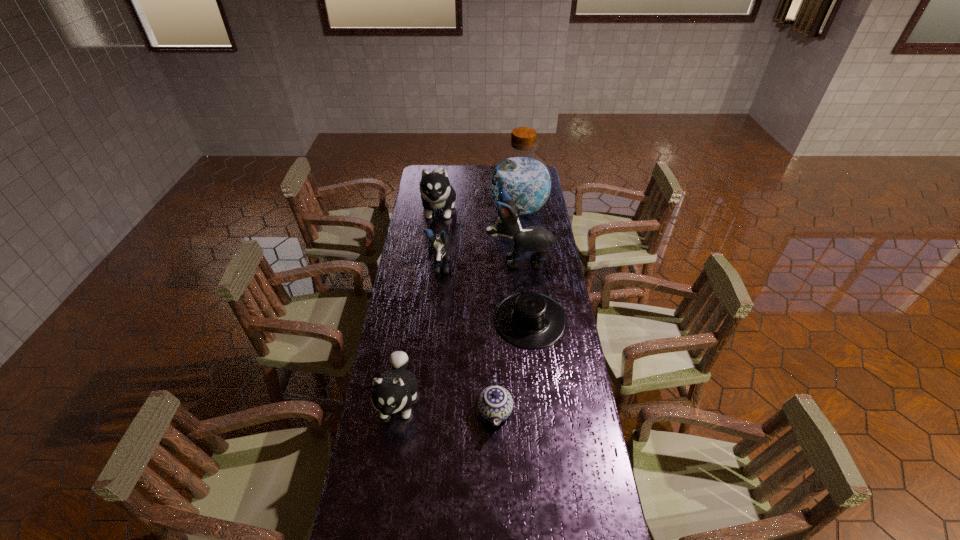
Locate an element on the screen. This screenshot has height=540, width=960. free space located on the left of the third nearest object is located at coordinates (444, 321).

What are the coordinates of `water jug present at the right edge` in the screenshot? It's located at (527, 179).

This screenshot has width=960, height=540. Find the location of `puppy located at the right edge`. puppy located at the right edge is located at coordinates (535, 238).

At what (x,y) coordinates should I click in order to perform the action: click on dress hat that is at the right edge. Please return your answer as a coordinate pair (x, y). This screenshot has width=960, height=540. Looking at the image, I should click on (529, 320).

Find the location of a particular element. This screenshot has width=960, height=540. vacant space at the left edge of the desktop is located at coordinates (428, 241).

I want to click on vacant area at the right edge of the desktop, so click(550, 258).

Image resolution: width=960 pixels, height=540 pixels. In order to click on vacant area that lies between the smaller white puppy and the blue water jug in this screenshot , I will do `click(458, 305)`.

Identify the location of empty location between the blue chinaware and the fifth tallest object. (446, 406).

Where is `unoccupied position between the blue water jug and the dress hat`? unoccupied position between the blue water jug and the dress hat is located at coordinates (524, 265).

This screenshot has height=540, width=960. I want to click on empty space between the bigger white puppy and the blue chinaware, so click(x=467, y=310).